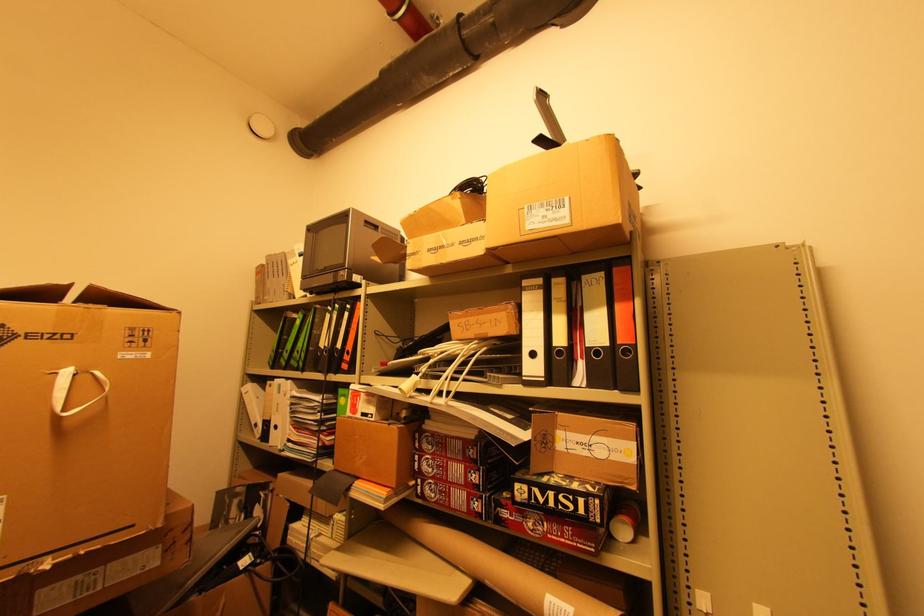
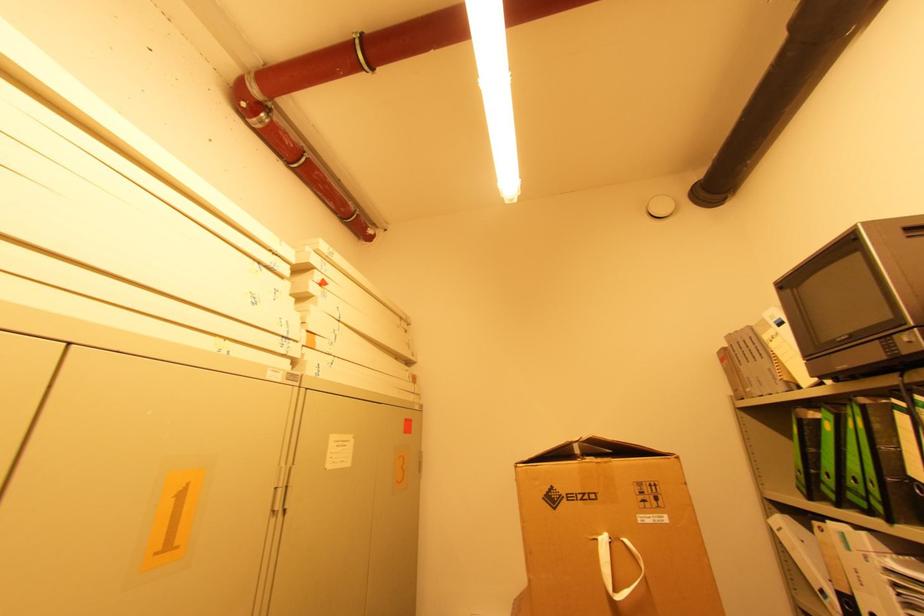
Where in the second image is the point corresponding to (286,353) from the first image?

(822, 476)